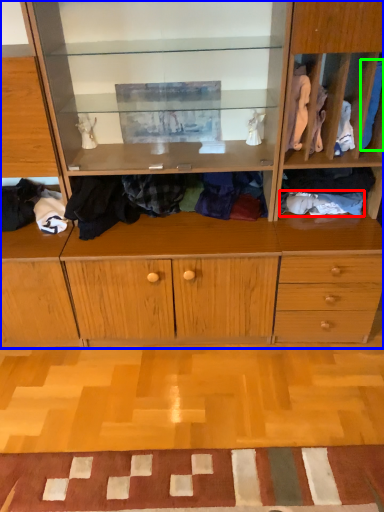
Question: Which is nearer to the clothing (highlighted by a red box)? cabinetry (highlighted by a blue box) or clothing (highlighted by a green box).

Choices:
 (A) cabinetry
 (B) clothing

Answer: (B)